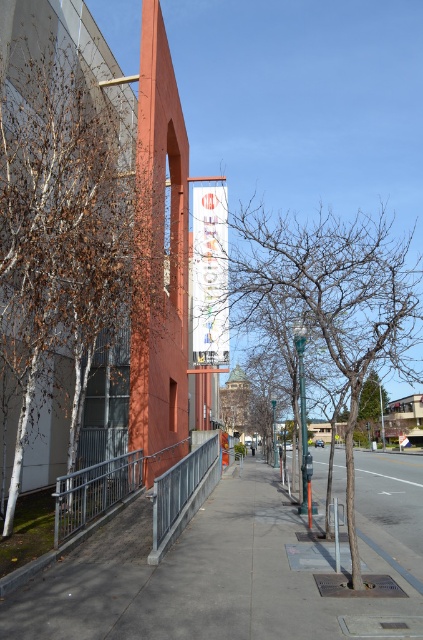
Question: Observing the image, what is the correct spatial positioning of gray concrete sidewalk at center in reference to silver metallic railing at center?

Choices:
 (A) left
 (B) right

Answer: (B)

Question: Is gray concrete sidewalk at center wider than green metallic pole at center?

Choices:
 (A) no
 (B) yes

Answer: (B)

Question: Which point appears closest to the camera in this image?

Choices:
 (A) (376, 360)
 (B) (137, 456)
 (C) (299, 404)
 (D) (96, 301)

Answer: (A)

Question: Is the position of brown bark tree at left more distant than that of metallic gray railing at lower left?

Choices:
 (A) yes
 (B) no

Answer: (B)

Question: Which object appears closest to the camera in this image?

Choices:
 (A) brown bark tree at left
 (B) green metallic street sign at center
 (C) silver metallic railing at center
 (D) bare branches at center

Answer: (D)

Question: Among these points, which one is nearest to the camera?

Choices:
 (A) (192, 451)
 (B) (304, 458)

Answer: (B)